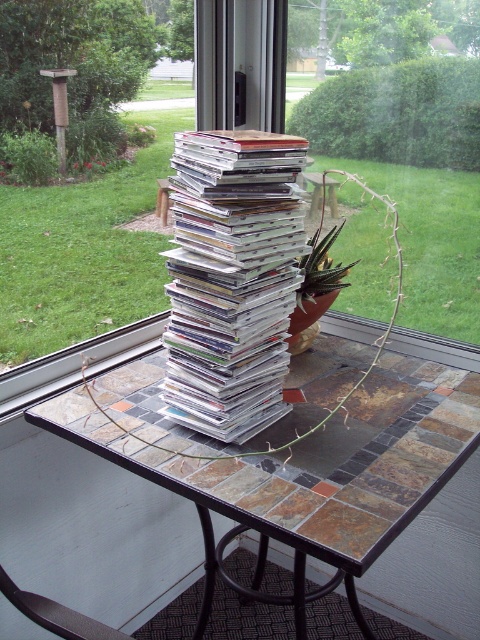
Based on the photo, you are a delivery person who just arrived at the house. You need to place a heavy box on the tile mosaic table at center without knocking over the green succulent at center. Can you do it safely?

The tile mosaic table at center has a lesser height compared to green succulent at center, so placing a heavy box on the table might cause the succulent to tip over since the table is shorter than the plant. To ensure safety, place the box away from the edge of the table or secure the succulent in a stable position.

You are looking at the scene through the window. There are two points marked in the image, point 1 at coordinates point (370,408) and point 2 at coordinates point (427,328). Which point is closer to you?

Point (370,408) is closer to the viewer than point (427,328).